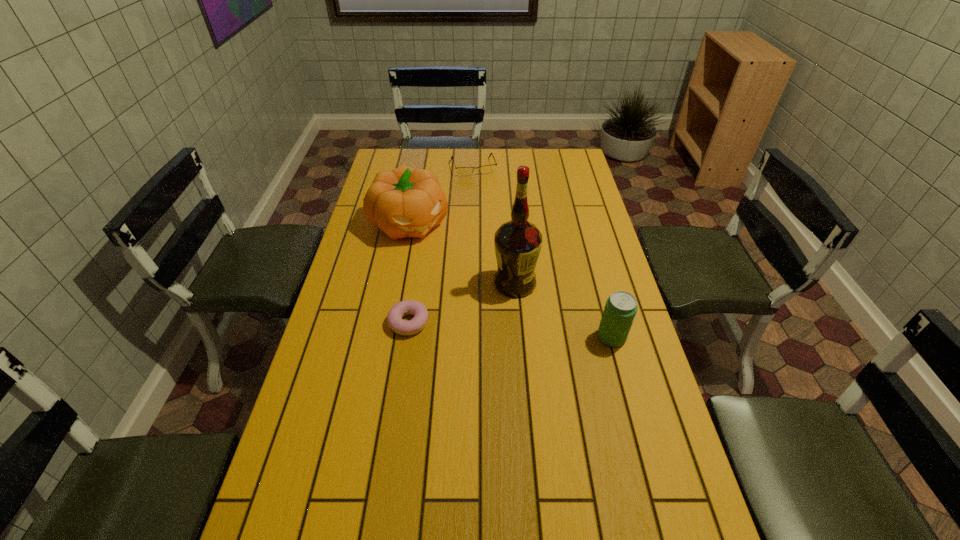
In order to click on blank region between the fourth shortest object and the doughnut in this screenshot , I will do `click(409, 273)`.

Find the location of a particular element. free area in between the third shortest object and the spectacles is located at coordinates (542, 252).

Where is `free space that is in between the doughnut and the rightmost object`? The height and width of the screenshot is (540, 960). free space that is in between the doughnut and the rightmost object is located at coordinates (510, 330).

Identify the location of unoccupied area between the pumpkin and the third farthest object. (463, 253).

I want to click on free space between the doughnut and the farthest object, so click(x=441, y=245).

The image size is (960, 540). Identify the location of unoccupied position between the soda and the tallest object. (564, 310).

Where is `object that is the second closest to the third tallest object`? The image size is (960, 540). object that is the second closest to the third tallest object is located at coordinates (394, 318).

Locate which object ranks in proximity to the doughnut. Please provide its 2D coordinates. Your answer should be formatted as a tuple, i.e. [(x, y)], where the tuple contains the x and y coordinates of a point satisfying the conditions above.

[(518, 242)]

Where is `free space that satisfies the following two spatial constraints: 1. on the back side of the fourth nearest object; 2. on the left side of the farthest object`? The width and height of the screenshot is (960, 540). free space that satisfies the following two spatial constraints: 1. on the back side of the fourth nearest object; 2. on the left side of the farthest object is located at coordinates (420, 166).

Locate an element on the screen. The image size is (960, 540). vacant area that satisfies the following two spatial constraints: 1. on the front side of the soda; 2. on the left side of the second tallest object is located at coordinates (388, 338).